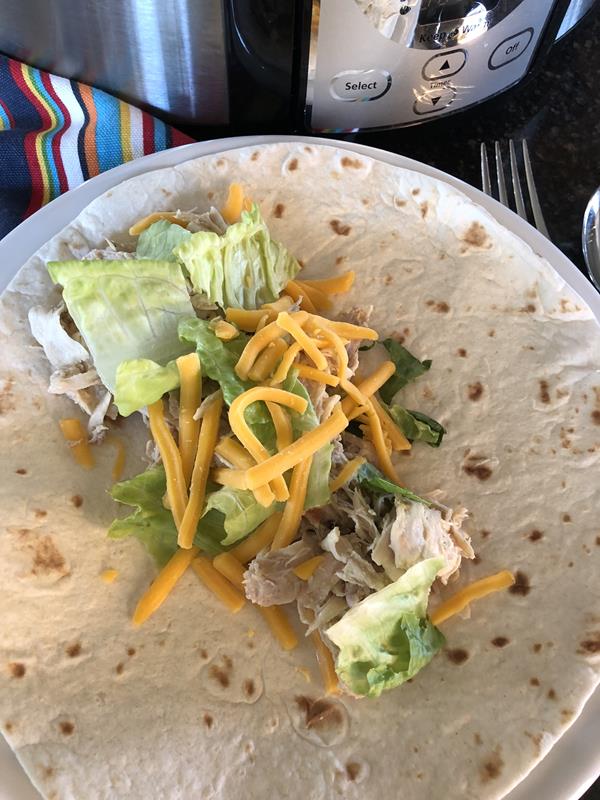
Identify the location of tablecloth. pyautogui.click(x=85, y=129).